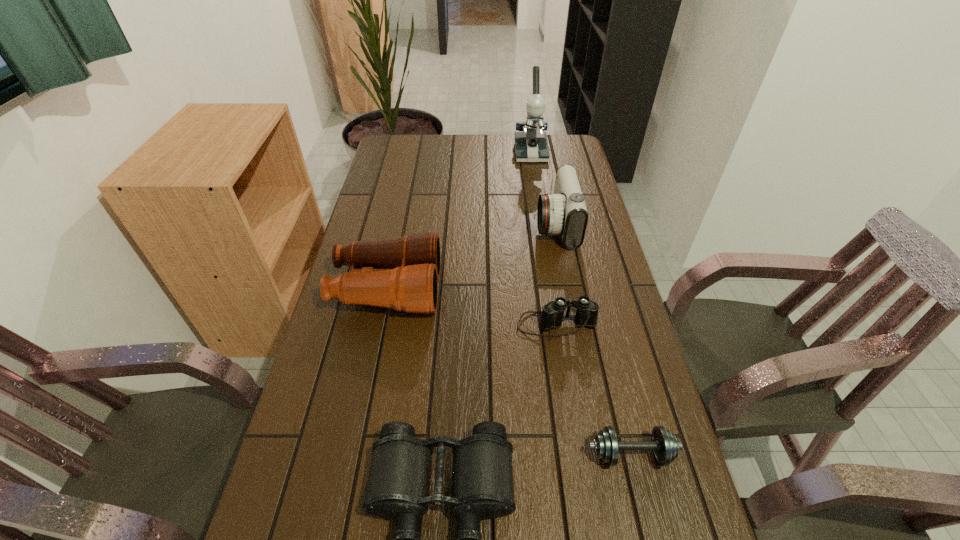
Where is `object at the far right corner`? object at the far right corner is located at coordinates (531, 145).

Find the location of a particular element. The image size is (960, 540). vacant region at the far edge of the desktop is located at coordinates (481, 154).

In the image, there is a desktop. At what (x,y) coordinates should I click in order to perform the action: click on blank space at the left edge. Please return your answer as a coordinate pair (x, y). Looking at the image, I should click on (334, 488).

You are a GUI agent. You are given a task and a screenshot of the screen. Output one action in this format:
    pyautogui.click(x=<x>, y=<y>)
    Task: Click on the free space at the right edge of the desktop
    The image size is (960, 540).
    Given the screenshot: What is the action you would take?
    pyautogui.click(x=636, y=390)

I want to click on vacant space at the far left corner, so click(x=408, y=152).

This screenshot has height=540, width=960. In order to click on vacant area between the second tallest object and the tallest object in this screenshot , I will do `click(543, 189)`.

Image resolution: width=960 pixels, height=540 pixels. I want to click on empty location between the farthest object and the fourth shortest object, so click(x=459, y=221).

Identify the location of vacant area that lies between the rightmost binoculars and the shortest object. The image size is (960, 540). (593, 389).

I want to click on free space between the third tallest object and the shortest object, so click(x=509, y=372).

Image resolution: width=960 pixels, height=540 pixels. I want to click on empty space between the rightmost binoculars and the tallest object, so click(543, 239).